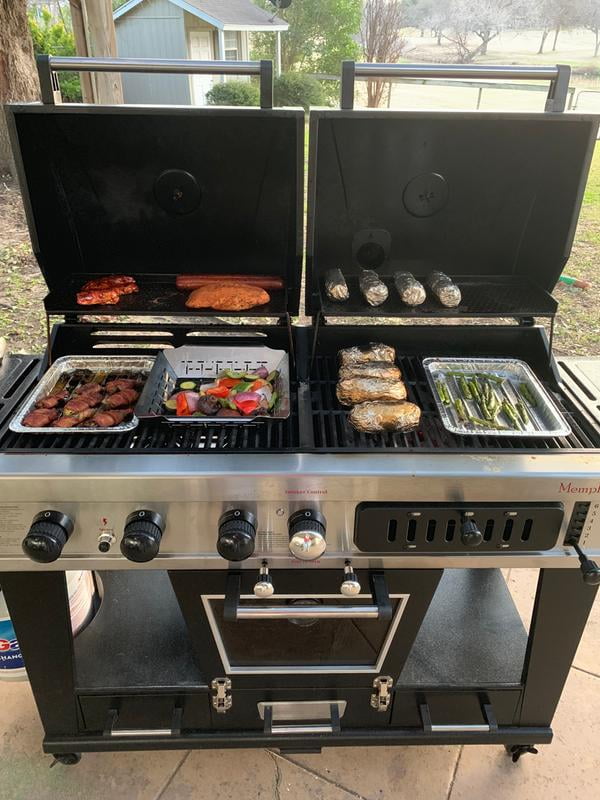
At what (x,y) coordinates should I click in order to perform the action: click on knob. Please return your answer as a coordinate pair (x, y). Looking at the image, I should click on (236, 546).